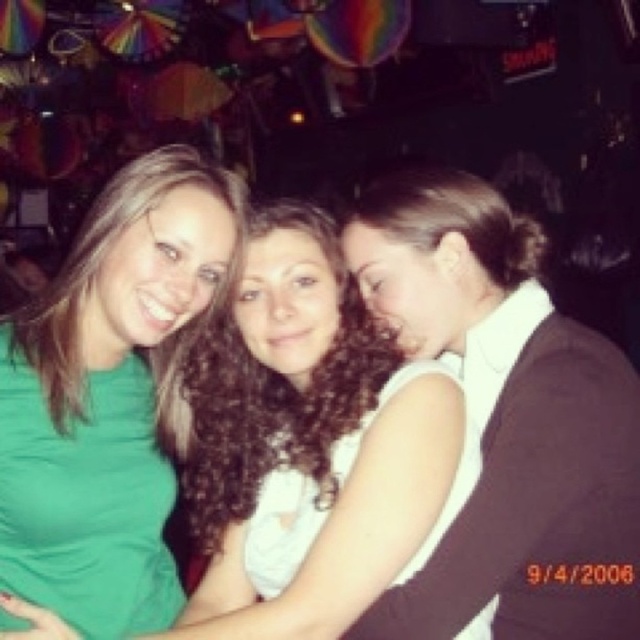
Is point (198, 401) positioned before point (173, 170)?

No.

Looking at this image, who is more forward, (376,436) or (120,506)?

Point (376,436) is more forward.

At what (x,y) coordinates should I click in order to perform the action: click on curly hair at center. Please return your answer as a coordinate pair (x, y). Looking at the image, I should click on (308, 444).